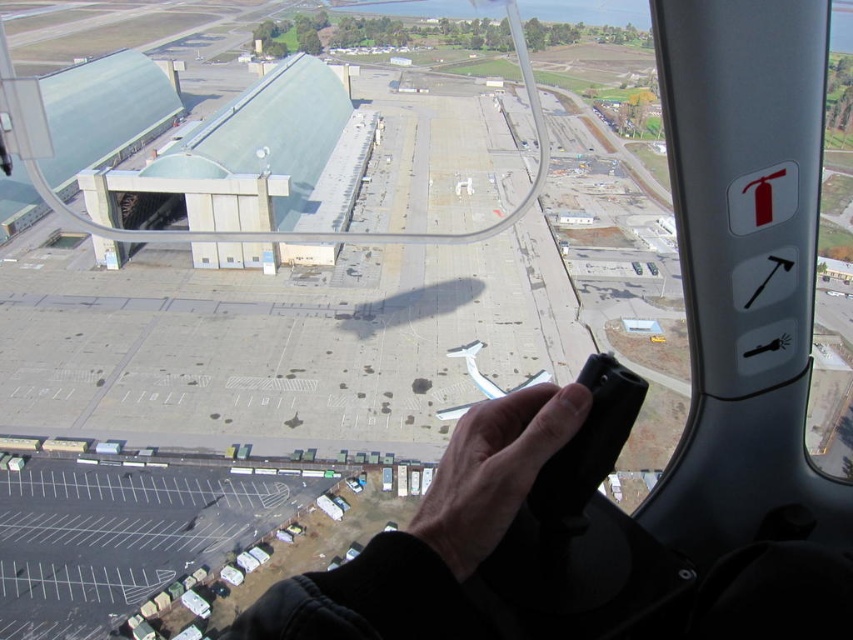
You are a pilot in the cockpit and need to grab the black matte remote control at center. Which direction should you move your hand to reach it from the light skin tone hand at center?

The black matte remote control at center is to the left of the light skin tone hand at center, so you should move your hand to the left to reach it.

You are a pilot preparing to land a drone on the airport tarmac. The drone has a landing pad marked at point (492,470). You notice a black matte remote control at center. Where should you aim the drone to ensure it lands safely?

The point (492,470) is located on the black matte remote control at center, so you should aim the drone to land precisely on the black matte remote control at center to ensure it reaches the correct landing pad.

You are a pilot preparing to start the engine of your aircraft. You notice a black matte remote control at center and a light skin tone hand at center near the controls. Which object is smaller in height?

The black matte remote control at center is shorter than the light skin tone hand at center, so the black matte remote control at center is smaller in height.